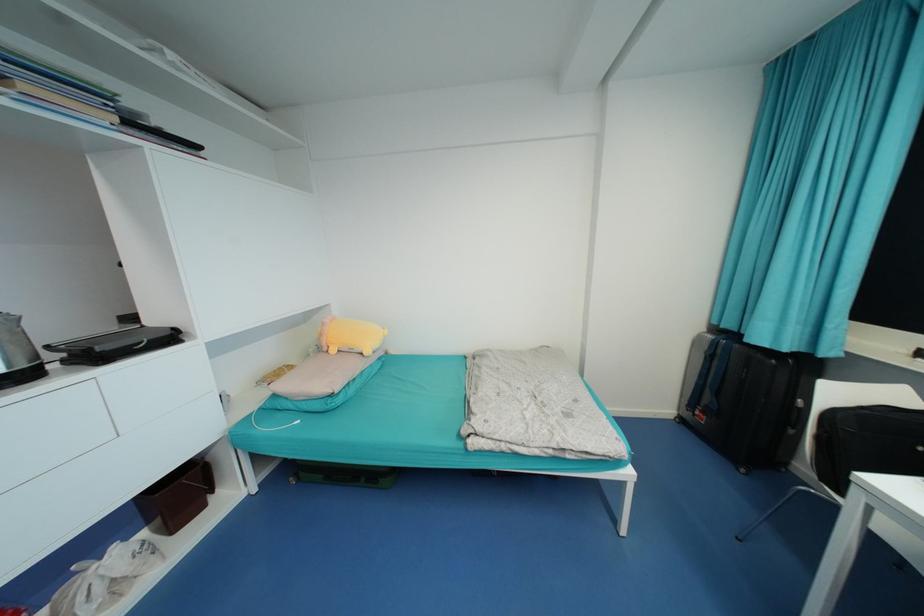
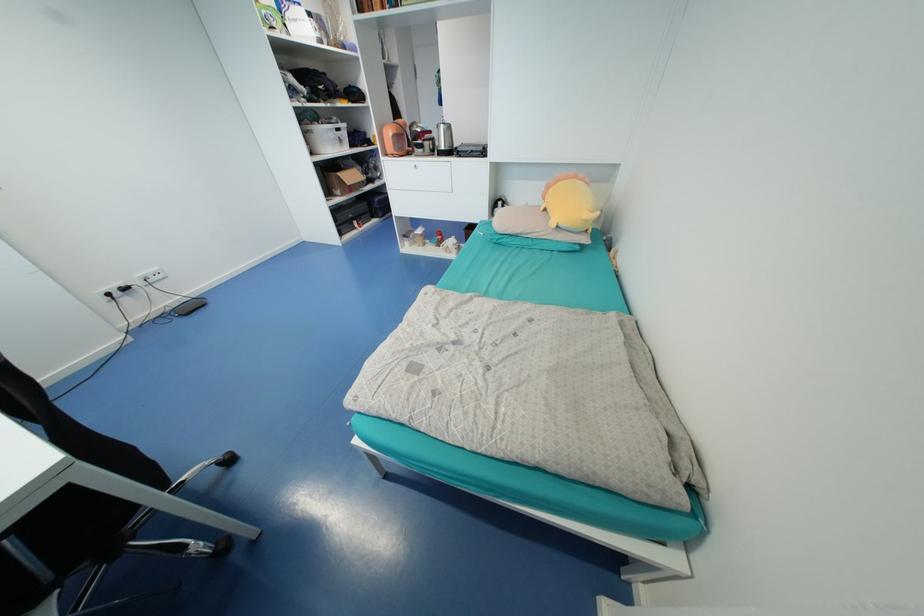
Question: I am providing you with two images of the same scene from different viewpoints. Which of the following objects are not visible in image2?

Choices:
 (A) black electronic device
 (B) white storage basket
 (C) pink plush toy
 (D) black appliance handle

Answer: (D)